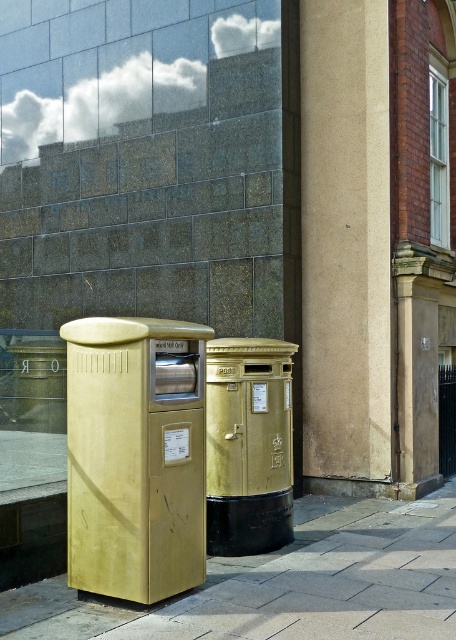
You are a delivery person trying to place a package in the gold matte postbox at center. There is a smooth beige pillar at center blocking your path. Can you walk around the pillar to reach the postbox?

The smooth beige pillar at center is positioned on the right side of gold matte postbox at center, so you can walk around the left side of the pillar to reach the postbox.

You are a delivery person carrying a large package that is 4 feet wide. You need to place it between the smooth concrete pavement at lower center and the matte gold mailbox at left. Is there enough space to fit the package?

The distance between the smooth concrete pavement at lower center and the matte gold mailbox at left is 3.81 feet, which is slightly less than the 4 feet width of the package. Therefore, there is not enough space to fit the package between them.

Consider the image. You are a delivery person trying to place a package between the smooth beige pillar at center and the gold matte postbox at center. Can you fit the package there?

The smooth beige pillar at center is further to the viewer than the gold matte postbox at center, so the space between them is narrow. The package may not fit unless it is very small.